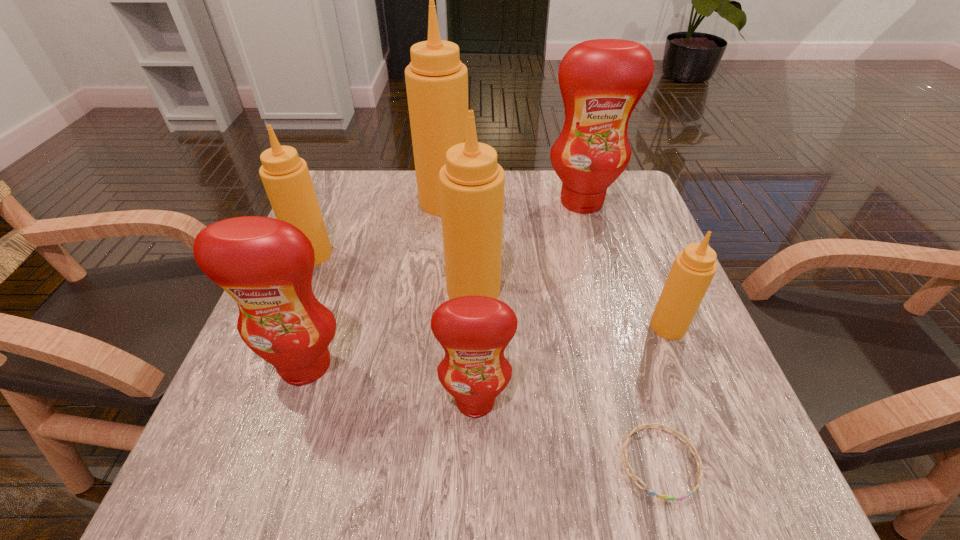
At what (x,y) coordinates should I click in order to perform the action: click on vacant space at the far right corner. Please return your answer as a coordinate pair (x, y). Looking at the image, I should click on (625, 189).

Find the location of a particular element. This screenshot has height=540, width=960. vacant region at the near right corner of the desktop is located at coordinates (685, 484).

Locate an element on the screen. This screenshot has width=960, height=540. empty space that is in between the second biggest tan condiment and the blue bracelet is located at coordinates (566, 376).

The image size is (960, 540). Identify the location of blank region between the fourth nearest condiment and the sixth nearest object. (393, 272).

Find the location of a particular element. free space between the leftmost red condiment and the second red condiment from right to left is located at coordinates (391, 383).

The width and height of the screenshot is (960, 540). I want to click on vacant point located between the third farthest tan condiment and the farthest red condiment, so click(x=527, y=246).

The height and width of the screenshot is (540, 960). What are the coordinates of `unoccupied area between the fifth nearest object and the leftmost red condiment` in the screenshot? It's located at (390, 328).

Where is `vacant space in between the fifth farthest object and the smallest red condiment`? This screenshot has height=540, width=960. vacant space in between the fifth farthest object and the smallest red condiment is located at coordinates (571, 363).

Identify the location of free space between the biggest tan condiment and the second smallest red condiment. (375, 283).

The image size is (960, 540). I want to click on free area in between the leftmost red condiment and the tallest object, so click(x=375, y=283).